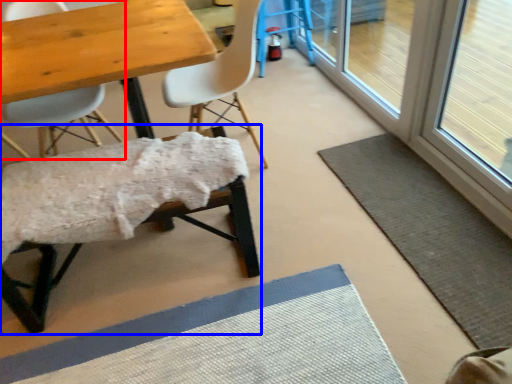
Question: Which of the following is the farthest to the observer, chair (highlighted by a red box) or chair (highlighted by a blue box)?

Choices:
 (A) chair
 (B) chair

Answer: (A)